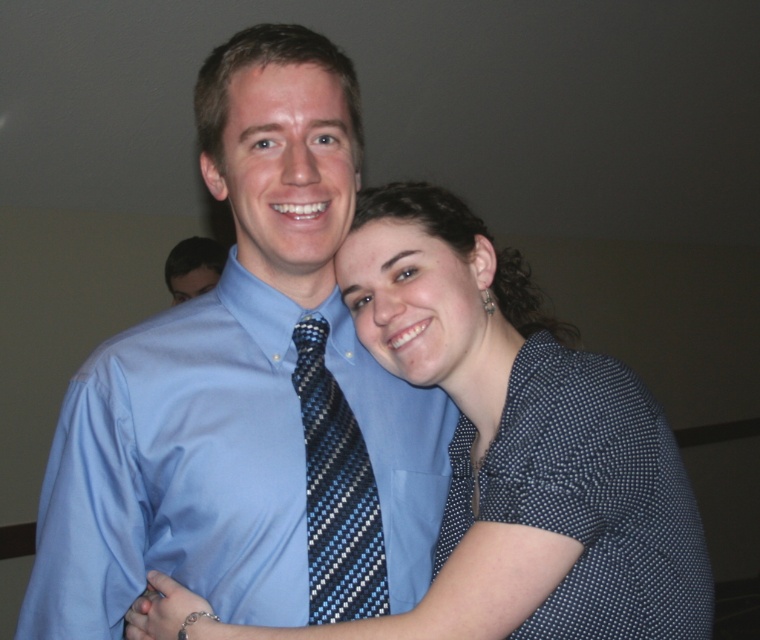
What is the location of the blue striped tie at center in the image?

The blue striped tie at center is located at point (336,492).

You are standing in front of the two people in the image. Which of the two points, point (190, 328) or point (333, 580), is closer to you?

Point (333, 580) is closer to you because it is in front of point (190, 328).

You are a photographer trying to adjust the focus on your camera. The focus point is set to point (363, 589). If the minimum focus distance of your camera is 36 inches, will the camera be able to focus on that point?

The distance of point (363, 589) from camera is 35.96 inches, which is slightly less than the camera minimum focus distance of 36 inches. Therefore, the camera might struggle to focus on that point as it is too close.